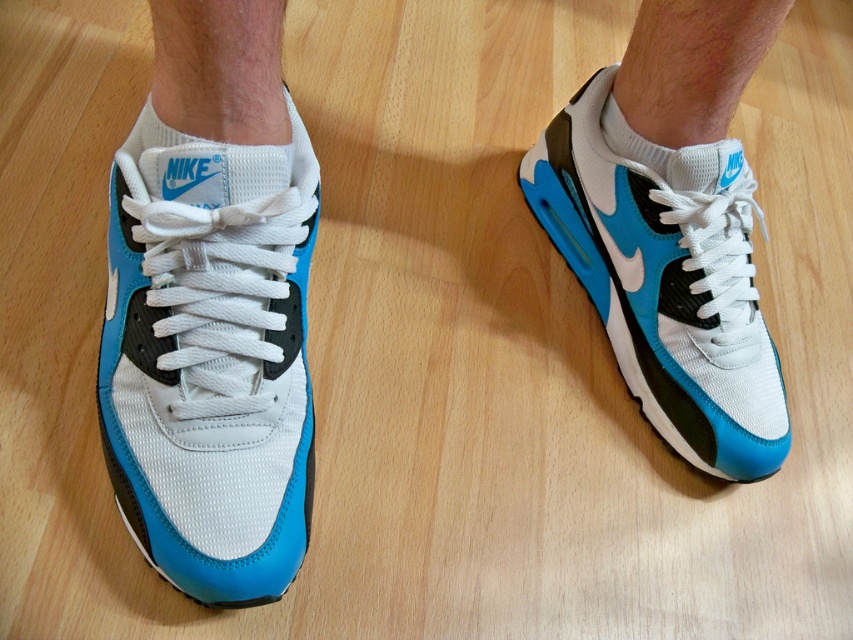
Who is positioned more to the left, white mesh shoe at center or matte mesh shoe at center?

From the viewer's perspective, white mesh shoe at center appears more on the left side.

Is white mesh shoe at center to the left of matte mesh shoe at center from the viewer's perspective?

Yes, white mesh shoe at center is to the left of matte mesh shoe at center.

The image size is (853, 640). I want to click on white mesh shoe at center, so click(x=210, y=356).